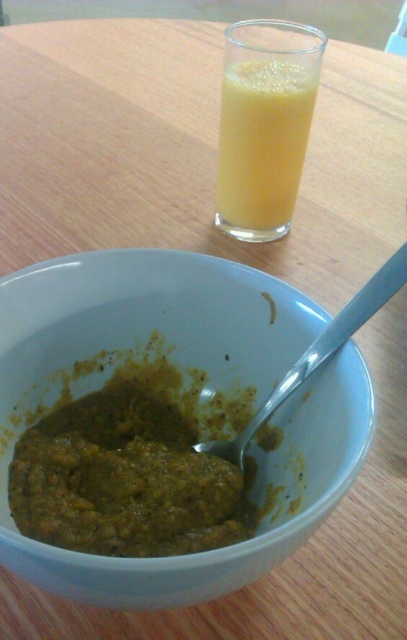
Does matte ceramic bowl at center have a smaller size compared to silver metallic spoon at bowl center?

Incorrect, matte ceramic bowl at center is not smaller in size than silver metallic spoon at bowl center.

Does point (277, 468) lie in front of point (339, 326)?

No, (277, 468) is further to viewer.

I want to click on matte ceramic bowl at center, so click(x=183, y=385).

Where is `matte ceramic bowl at center`? matte ceramic bowl at center is located at coordinates (183, 385).

Is matte ceramic bowl at center below yellow translucent glass at upper center?

Correct, matte ceramic bowl at center is located below yellow translucent glass at upper center.

Between matte ceramic bowl at center and yellow translucent glass at upper center, which one is positioned higher?

Positioned higher is yellow translucent glass at upper center.

Is point (70, 314) less distant than point (221, 132)?

Yes, it is.

What are the coordinates of `matte ceramic bowl at center` in the screenshot? It's located at (183, 385).

Does yellow translucent glass at upper center have a lesser width compared to silver metallic spoon at bowl center?

Yes.

Looking at this image, which is more to the left, yellow translucent glass at upper center or silver metallic spoon at bowl center?

yellow translucent glass at upper center

This screenshot has width=407, height=640. Describe the element at coordinates (262, 145) in the screenshot. I see `yellow translucent glass at upper center` at that location.

This screenshot has width=407, height=640. What are the coordinates of `yellow translucent glass at upper center` in the screenshot? It's located at (262, 145).